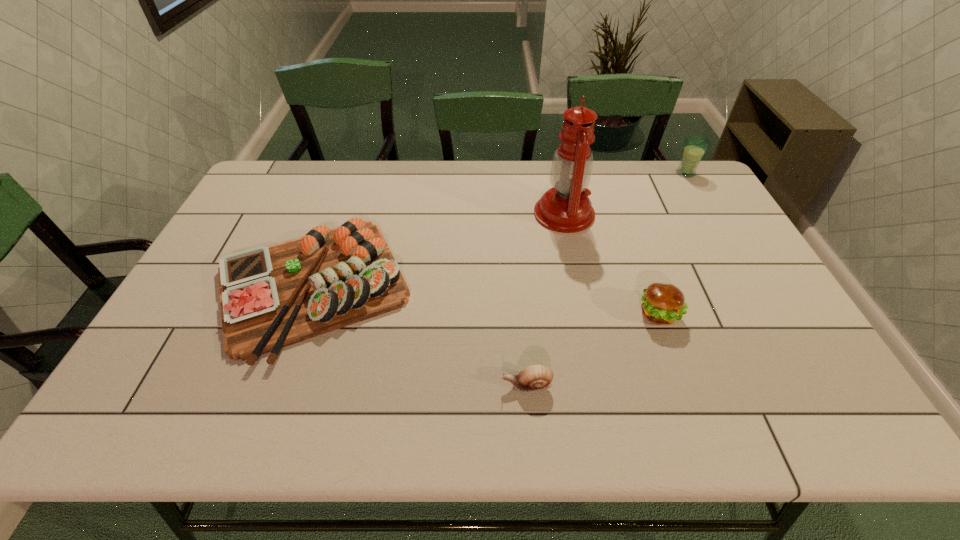
You are a GUI agent. You are given a task and a screenshot of the screen. Output one action in this format:
    pyautogui.click(x=<x>, y=<y>)
    Task: Click on the oil lamp
    Image resolution: width=960 pixels, height=540 pixels.
    Given the screenshot: What is the action you would take?
    pyautogui.click(x=566, y=208)

At what (x,y) coordinates should I click in order to perform the action: click on the tallest object. Please return your answer as a coordinate pair (x, y). The image size is (960, 540). Looking at the image, I should click on (566, 208).

Where is `glass`? This screenshot has width=960, height=540. glass is located at coordinates (695, 146).

Locate an element on the screen. the farthest object is located at coordinates (695, 146).

Locate an element on the screen. hamburger is located at coordinates (662, 304).

The height and width of the screenshot is (540, 960). What are the coordinates of `platter` in the screenshot? It's located at (271, 297).

Find the location of a particular element. The image size is (960, 540). the shortest object is located at coordinates (535, 377).

The height and width of the screenshot is (540, 960). In order to click on the fourth object from right to left in this screenshot , I will do `click(535, 377)`.

Image resolution: width=960 pixels, height=540 pixels. Identify the location of vacant area situated 0.190m on the right of the oil lamp. (654, 214).

What are the coordinates of `free space located 0.270m on the left of the glass` in the screenshot? It's located at (599, 173).